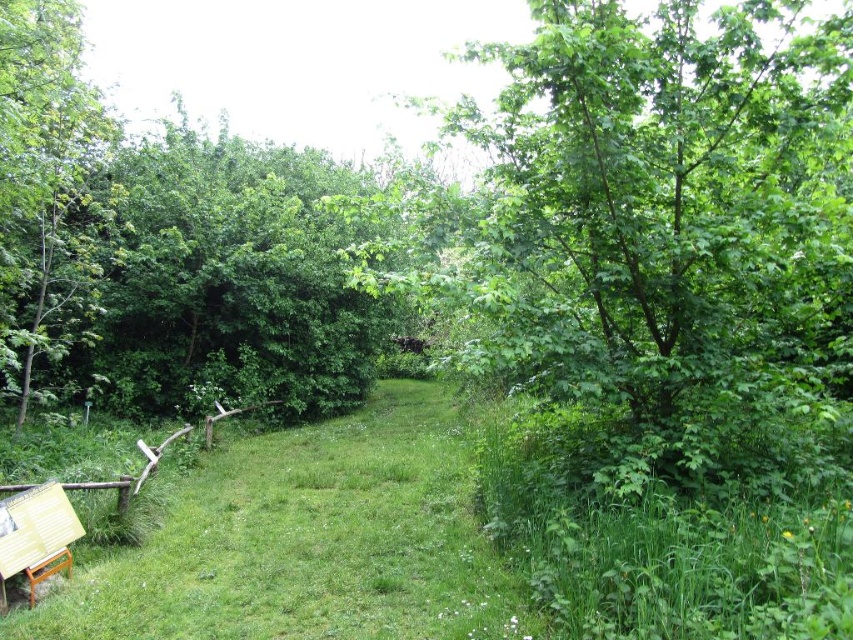
Question: Does green leafy tree at center come behind green leafy tree at left?

Choices:
 (A) yes
 (B) no

Answer: (B)

Question: Which of the following is the closest to the observer?

Choices:
 (A) green leafy tree at left
 (B) green leafy tree at upper left
 (C) green grass at center

Answer: (C)

Question: Can you confirm if green leafy tree at upper left is wider than green leafy tree at left?

Choices:
 (A) yes
 (B) no

Answer: (B)

Question: Considering the real-world distances, which object is farthest from the green leafy tree at left?

Choices:
 (A) green leafy tree at upper left
 (B) green leafy tree at center
 (C) wooden sign at lower left
 (D) green grass at center

Answer: (D)

Question: Which of the following is the farthest from the observer?

Choices:
 (A) green leafy tree at upper left
 (B) green leafy tree at center

Answer: (A)

Question: Can you confirm if green leafy tree at center is smaller than green grass at center?

Choices:
 (A) no
 (B) yes

Answer: (A)